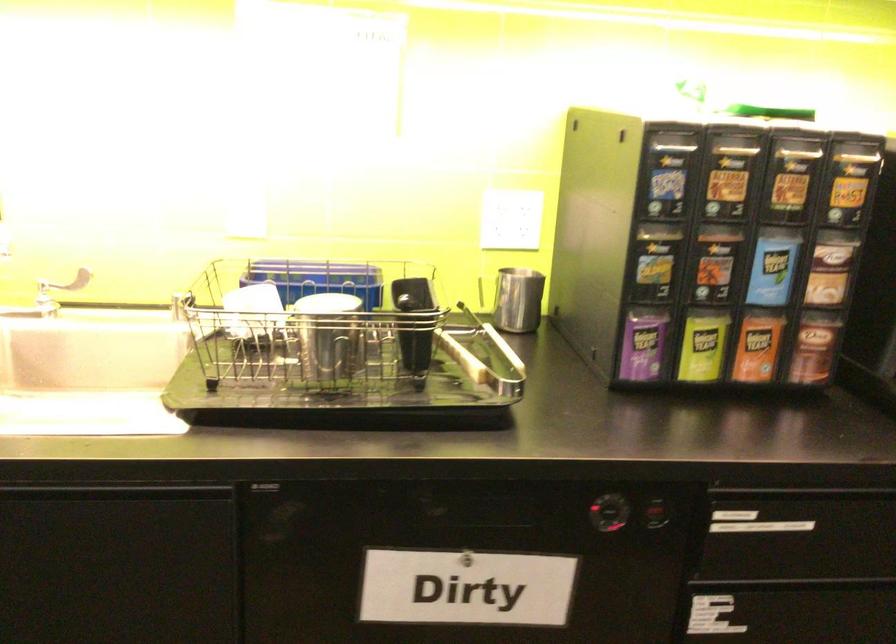
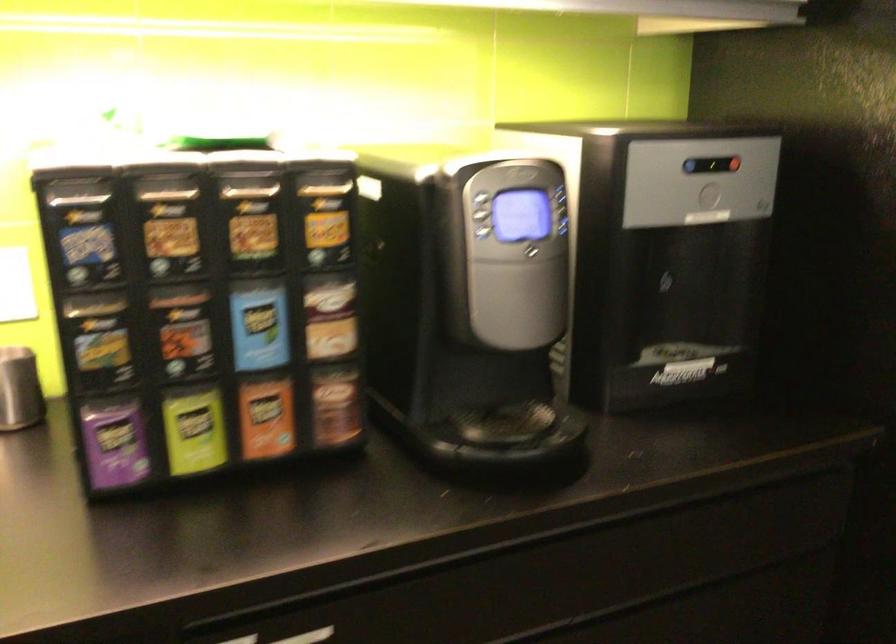
Where in the second image is the point corresponding to point 530,299 from the first image?

(19, 389)